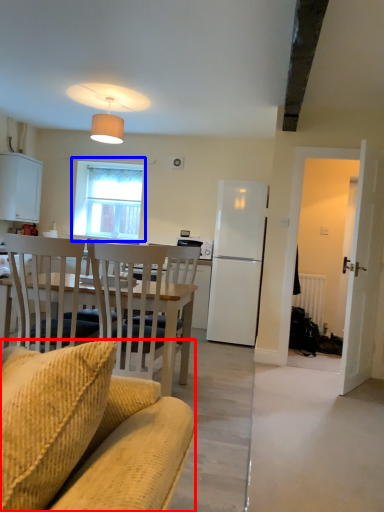
Question: Which object appears closest to the camera in this image, chair (highlighted by a red box) or window (highlighted by a blue box)?

Choices:
 (A) chair
 (B) window

Answer: (A)